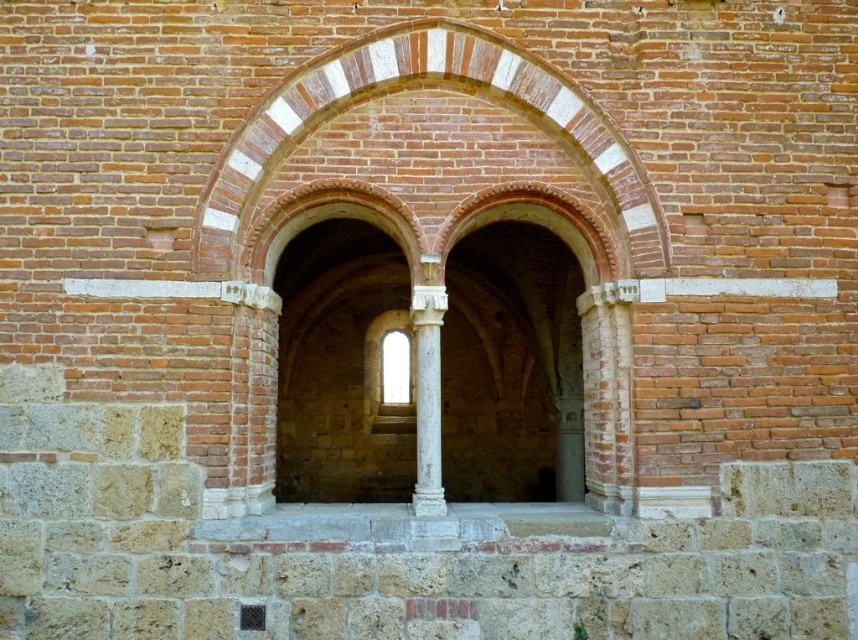
You are an architect examining the historical building. You notice the white marble column at center and the clear glass window at center. Based on their positions, which one is closer to the ground?

The white marble column at center is below the clear glass window at center, so it is closer to the ground than the window.

You are an architect examining the historical building. You notice the white marble column at center and the clear glass window at center. Which object is located to the right of the other?

The white marble column at center is positioned on the right side of clear glass window at center.